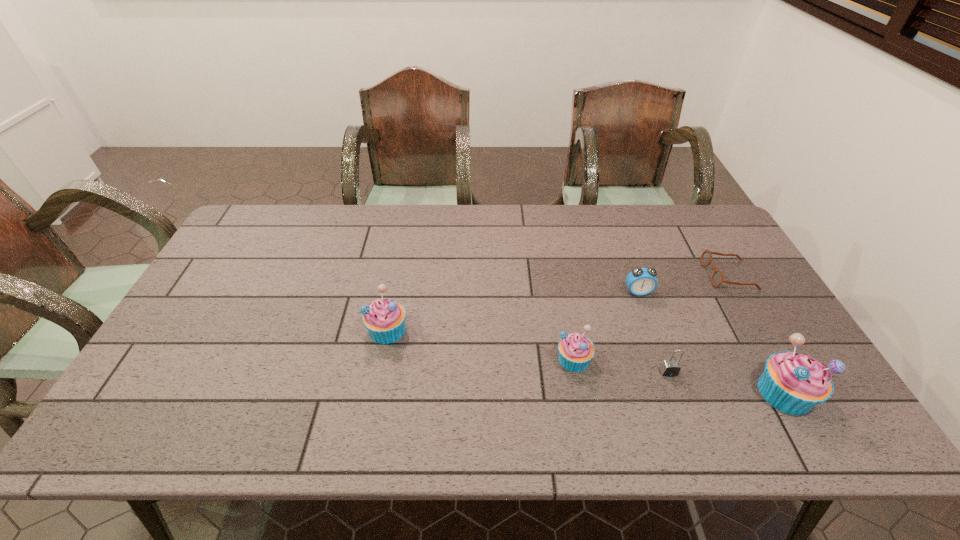
I want to click on the leftmost object, so click(x=384, y=319).

What are the coordinates of `the second tallest muffin` in the screenshot? It's located at (384, 319).

The width and height of the screenshot is (960, 540). What are the coordinates of `the second object from left to right` in the screenshot? It's located at (576, 351).

Locate an element on the screen. The width and height of the screenshot is (960, 540). the shortest muffin is located at coordinates (576, 351).

I want to click on the tallest muffin, so click(793, 383).

The width and height of the screenshot is (960, 540). What are the coordinates of `the rightmost muffin` in the screenshot? It's located at (793, 383).

The height and width of the screenshot is (540, 960). Find the location of `alarm clock`. alarm clock is located at coordinates (641, 281).

Identify the location of the shortest object. The image size is (960, 540). (717, 277).

Locate an element on the screen. padlock is located at coordinates (669, 368).

The height and width of the screenshot is (540, 960). Find the location of `vacant space located on the right of the fifth shortest object`. vacant space located on the right of the fifth shortest object is located at coordinates (549, 329).